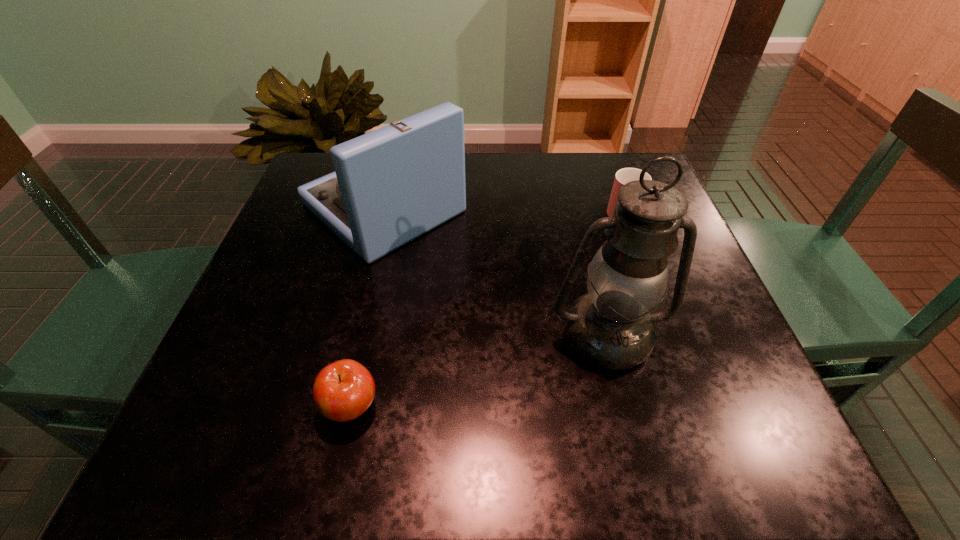
Find the location of `free spot located on the left of the apple`. free spot located on the left of the apple is located at coordinates (240, 406).

This screenshot has width=960, height=540. I want to click on phonograph record situated at the far edge, so click(x=390, y=186).

The width and height of the screenshot is (960, 540). I want to click on cup present at the far edge, so click(623, 176).

You are a GUI agent. You are given a task and a screenshot of the screen. Output one action in this format:
    pyautogui.click(x=<x>, y=<y>)
    Task: Click on the object located at the near edge
    The image size is (960, 540).
    Given the screenshot: What is the action you would take?
    pyautogui.click(x=343, y=390)

Where is `object that is at the left edge`? object that is at the left edge is located at coordinates pyautogui.click(x=390, y=186).

This screenshot has width=960, height=540. Find the location of `oil lamp located in the right edge section of the desktop`. oil lamp located in the right edge section of the desktop is located at coordinates (611, 327).

This screenshot has height=540, width=960. Find the location of `cup that is positioned at the right edge`. cup that is positioned at the right edge is located at coordinates (623, 176).

Find the location of `object that is at the far left corner`. object that is at the far left corner is located at coordinates pyautogui.click(x=390, y=186).

I want to click on object located in the far right corner section of the desktop, so click(623, 176).

In the image, there is a desktop. Find the location of `free region at the far edge`. free region at the far edge is located at coordinates (590, 200).